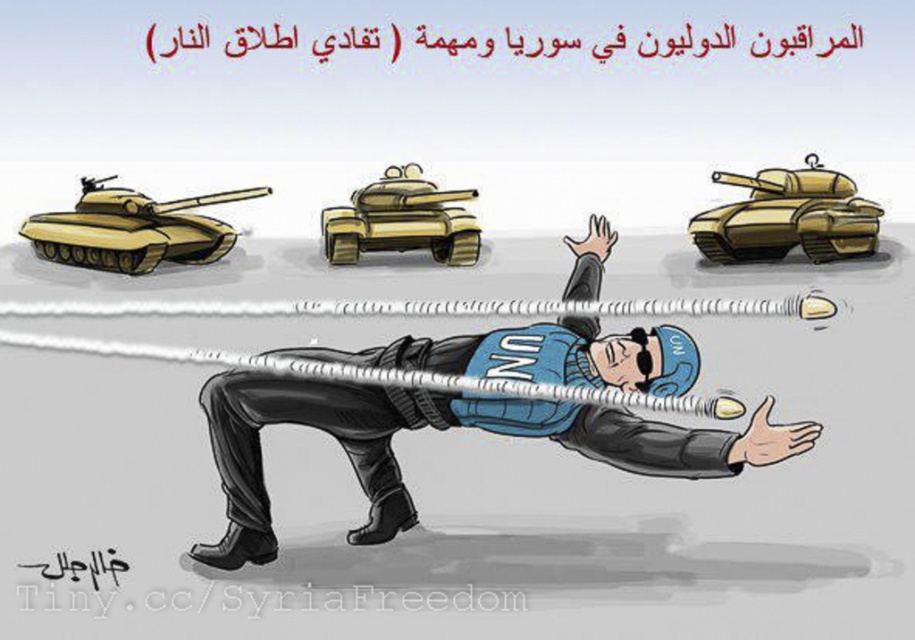
Is point (372, 458) closer to camera compared to point (354, 260)?

Yes, point (372, 458) is in front of point (354, 260).

Is blue fabric un vest at center wider than gold metallic tank at center?

Yes.

Is point (652, 378) positioned behind point (385, 195)?

No, it is in front of (385, 195).

The width and height of the screenshot is (915, 640). I want to click on blue fabric un vest at center, so click(x=440, y=428).

Which is below, blue fabric un vest at center or gold metallic tank at upper right?

blue fabric un vest at center

Who is more distant from viewer, (779, 435) or (825, 179)?

The point (825, 179) is more distant.

At what (x,y) coordinates should I click in order to perform the action: click on blue fabric un vest at center. Please return your answer as a coordinate pair (x, y). Image resolution: width=915 pixels, height=640 pixels. Looking at the image, I should click on (440, 428).

Who is higher up, blue fabric un vest at center or matte yellow tank at left?

matte yellow tank at left is above.

Does blue fabric un vest at center appear on the right side of matte yellow tank at left?

Indeed, blue fabric un vest at center is positioned on the right side of matte yellow tank at left.

Which is behind, point (385, 534) or point (98, 198)?

Positioned behind is point (98, 198).

Identify the location of blue fabric un vest at center. (440, 428).